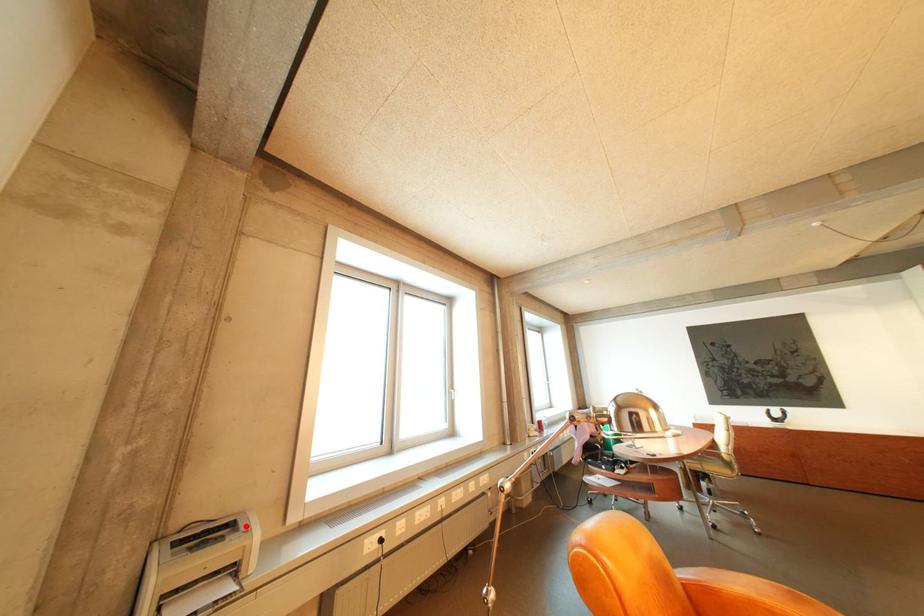
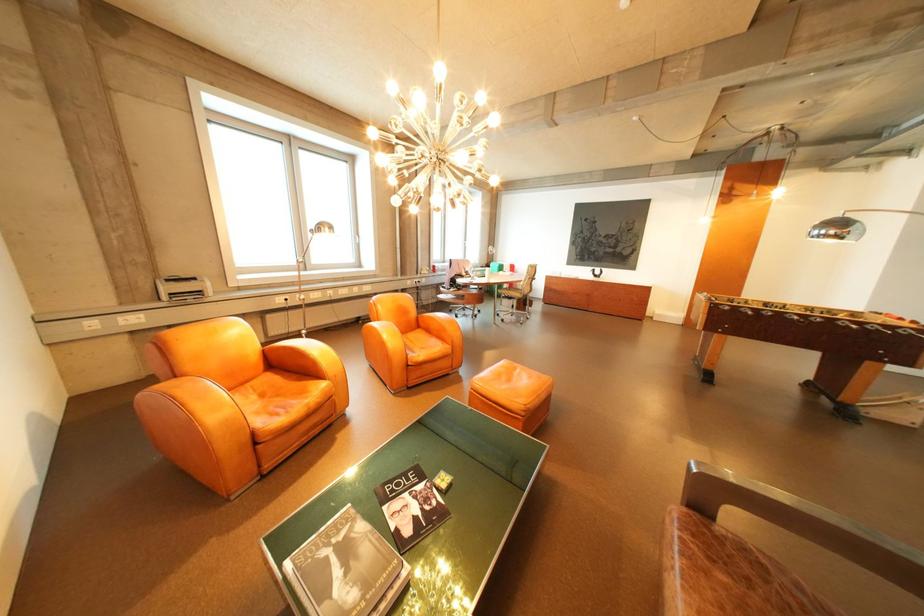
Locate, in the second image, the point that corresponds to the highlighted location in the first image.

(208, 280)